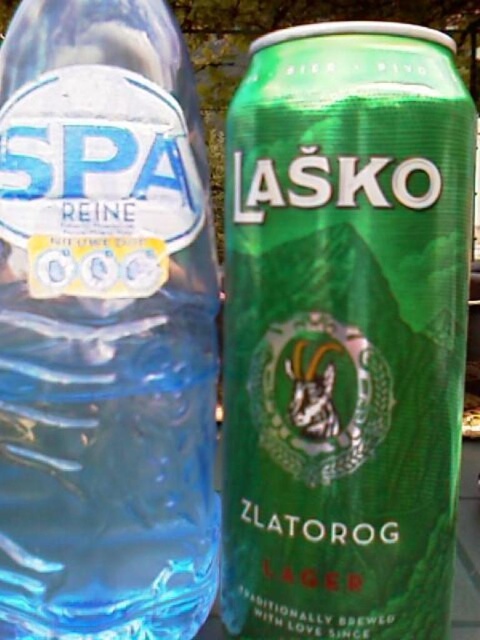
Looking at this image, you are organizing a picnic and have both a green matte can at right and a transparent plastic bottle at left. Which one is positioned more to the east if the image is oriented with the sun rising from the left side?

The green matte can at right is positioned more to the east because it is to the right of the transparent plastic bottle at left, and the sun rises from the left, meaning east is to the right in the image orientation.

You are holding a green matte can at right and a transparent plastic bottle at left. Which one is positioned lower in the image?

The green matte can at right is located below the transparent plastic bottle at left, so it is positioned lower in the image.

You are organizing a picnic and have both a green matte can at right and a transparent plastic bottle at left. You need to place them on a shelf that is 6 centimeters wide. Can both items fit side by side on the shelf without overlapping?

The distance between the green matte can at right and transparent plastic bottle at left is 6.44 centimeters. Since the shelf is only 6 centimeters wide, the items cannot fit side by side without overlapping.